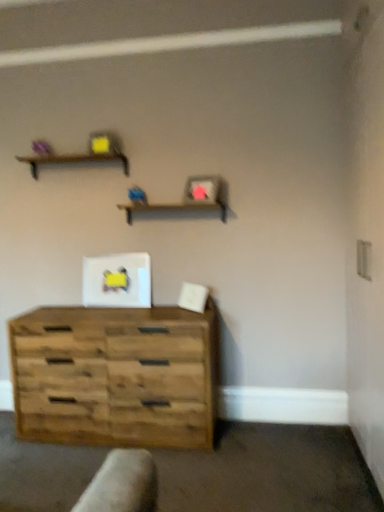
The width and height of the screenshot is (384, 512). What are the coordinates of `free space above brown wooden shelf at upper center, the 2th shelf from the right (from a real-world perspective)` in the screenshot? It's located at (83, 154).